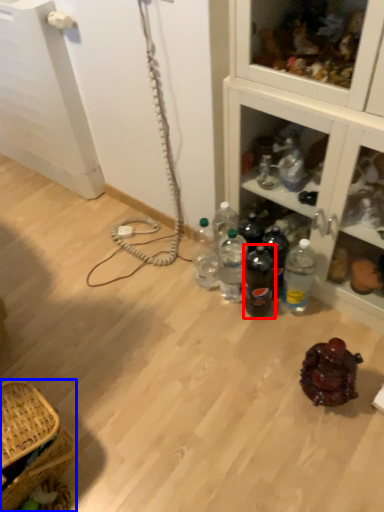
Question: Which point is further to the camera, bottle (highlighted by a red box) or picnic basket (highlighted by a blue box)?

Choices:
 (A) bottle
 (B) picnic basket

Answer: (A)